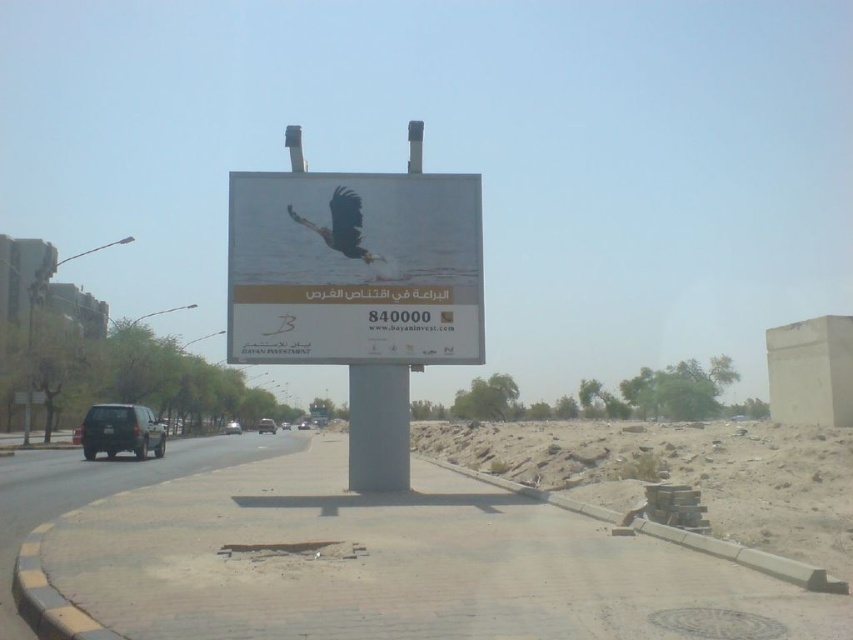
You are a pedestrian standing at the edge of the roundabout and see the matte black suv at lower left and the silver metallic car at center. Which vehicle is positioned higher relative to the other?

The matte black suv at lower left is located above the silver metallic car at center, so it is positioned higher.

You are driving a car that is 4.5 meters long. You want to park your car perpendicular to the gray metallic pole at center. Is there enough space between the pole and the road edge to park your car?

The distance between the gray metallic pole at center and the camera is 15.19 meters. Since the car is 4.5 meters long and parked perpendicular, there is sufficient space as 15.19 meters is more than enough for parking.